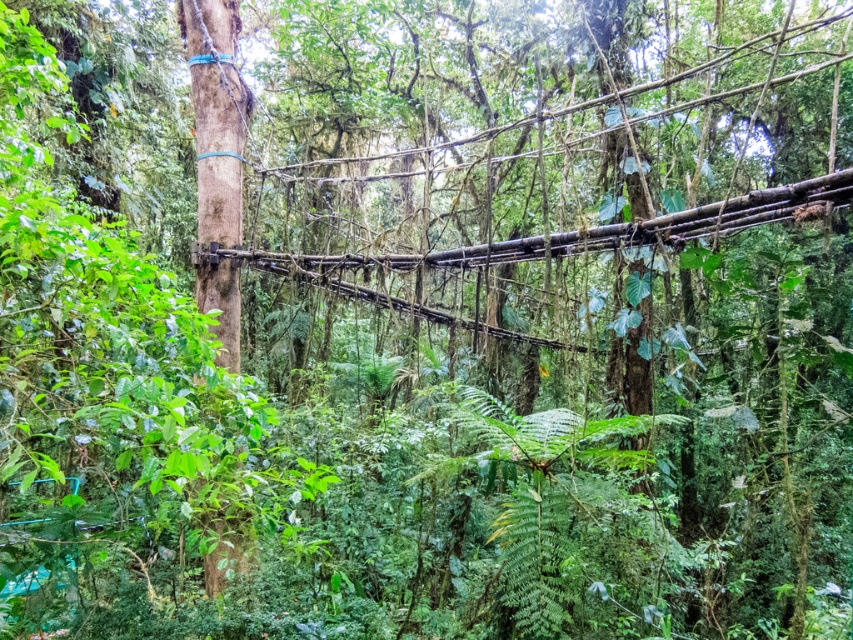
You are standing on the suspension bridge in the jungle and notice two points marked on the structure. The first point is at coordinate [639,225], and the second is at [235,360]. Which of these points is nearer to you as you stand on the bridge?

Point [639,225] is closer to the viewer than point [235,360].

You are an adventurer trying to cross the jungle. You see the brown woven rope bridge at center and the smooth brown tree trunk at center. How far apart are these two landmarks?

The brown woven rope bridge at center is 8.65 feet away from the smooth brown tree trunk at center.